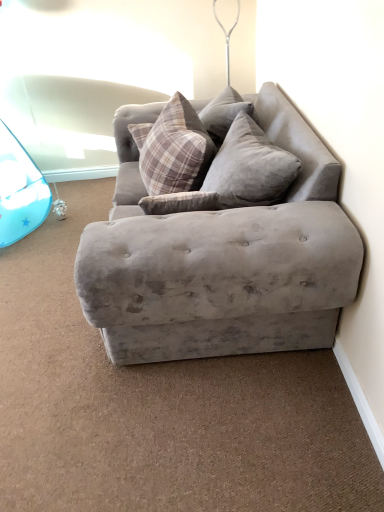
Question: From a real-world perspective, is velvet gray couch at center on velvet gray pillow at center, acting as the second pillow starting from the left?

Choices:
 (A) no
 (B) yes

Answer: (A)

Question: Is velvet gray couch at center not near velvet gray pillow at center, positioned as the first pillow in right-to-left order?

Choices:
 (A) yes
 (B) no

Answer: (B)

Question: Is velvet gray couch at center positioned with its back to velvet gray pillow at center, acting as the second pillow starting from the left?

Choices:
 (A) no
 (B) yes

Answer: (B)

Question: From a real-world perspective, is velvet gray couch at center positioned under velvet gray pillow at center, acting as the second pillow starting from the left, based on gravity?

Choices:
 (A) no
 (B) yes

Answer: (B)

Question: From the image's perspective, is velvet gray couch at center under velvet gray pillow at center, acting as the second pillow starting from the left?

Choices:
 (A) no
 (B) yes

Answer: (B)

Question: In the image, is velvet gray couch at center positioned in front of or behind velvet gray pillow at center, acting as the second pillow starting from the left?

Choices:
 (A) behind
 (B) front

Answer: (B)

Question: Is velvet gray couch at center situated inside velvet gray pillow at center, positioned as the first pillow in right-to-left order, or outside?

Choices:
 (A) outside
 (B) inside

Answer: (A)

Question: Is velvet gray couch at center bigger or smaller than velvet gray pillow at center, acting as the second pillow starting from the left?

Choices:
 (A) big
 (B) small

Answer: (A)

Question: Is velvet gray couch at center taller or shorter than velvet gray pillow at center, positioned as the first pillow in right-to-left order?

Choices:
 (A) tall
 (B) short

Answer: (A)

Question: Would you say velvet gray pillow at center, positioned as the first pillow in right-to-left order, is inside or outside plaid fabric pillow at upper center, the first pillow from the left?

Choices:
 (A) outside
 (B) inside

Answer: (A)

Question: Is velvet gray pillow at center, positioned as the first pillow in right-to-left order, taller or shorter than plaid fabric pillow at upper center, the first pillow from the left?

Choices:
 (A) short
 (B) tall

Answer: (A)

Question: In terms of size, does velvet gray pillow at center, acting as the second pillow starting from the left, appear bigger or smaller than plaid fabric pillow at upper center, the first pillow from the left?

Choices:
 (A) big
 (B) small

Answer: (B)

Question: In the image, is velvet gray pillow at center, acting as the second pillow starting from the left, positioned in front of or behind plaid fabric pillow at upper center, the first pillow from the left?

Choices:
 (A) front
 (B) behind

Answer: (A)

Question: Visually, is velvet gray couch at center positioned to the left or to the right of plaid fabric pillow at upper center, which ranks as the 2th pillow in right-to-left order?

Choices:
 (A) left
 (B) right

Answer: (B)

Question: From the image's perspective, is velvet gray couch at center positioned above or below plaid fabric pillow at upper center, which ranks as the 2th pillow in right-to-left order?

Choices:
 (A) above
 (B) below

Answer: (B)